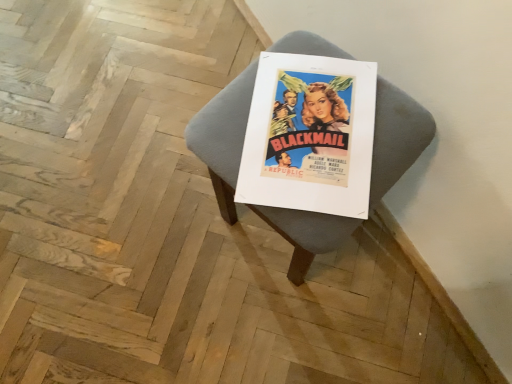
The width and height of the screenshot is (512, 384). Find the location of `vacant area that is in front of matte gray cushion at center`. vacant area that is in front of matte gray cushion at center is located at coordinates (296, 326).